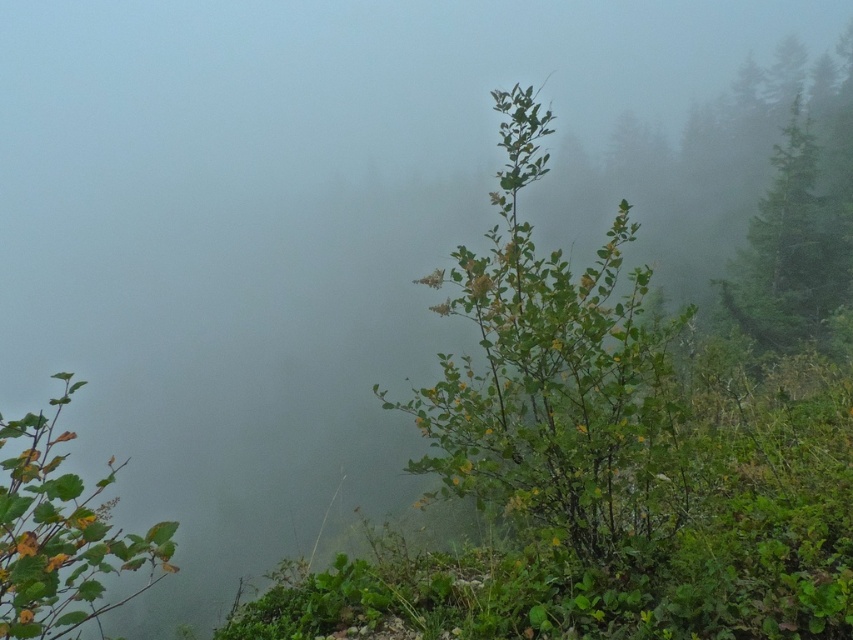
Does green leafy bush at center appear over green leafy shrub at lower left?

Yes, green leafy bush at center is above green leafy shrub at lower left.

Who is positioned more to the right, green leafy bush at center or green leafy shrub at lower left?

Positioned to the right is green leafy bush at center.

Is point (634, 458) closer to viewer compared to point (62, 616)?

No, it is not.

At what (x,y) coordinates should I click in order to perform the action: click on green leafy bush at center. Please return your answer as a coordinate pair (x, y). The height and width of the screenshot is (640, 853). Looking at the image, I should click on (553, 378).

Based on the photo, can you confirm if green leafy bush at center is thinner than green leafy tree at upper right?

Indeed, green leafy bush at center has a lesser width compared to green leafy tree at upper right.

You are a GUI agent. You are given a task and a screenshot of the screen. Output one action in this format:
    pyautogui.click(x=<x>, y=<y>)
    Task: Click on the green leafy bush at center
    
    Given the screenshot: What is the action you would take?
    pyautogui.click(x=553, y=378)

Is point (21, 541) positioned behind point (836, 161)?

No, it is in front of (836, 161).

Is green leafy shrub at lower left taller than green leafy tree at upper right?

Yes.

Locate an element on the screen. This screenshot has width=853, height=640. green leafy shrub at lower left is located at coordinates (61, 534).